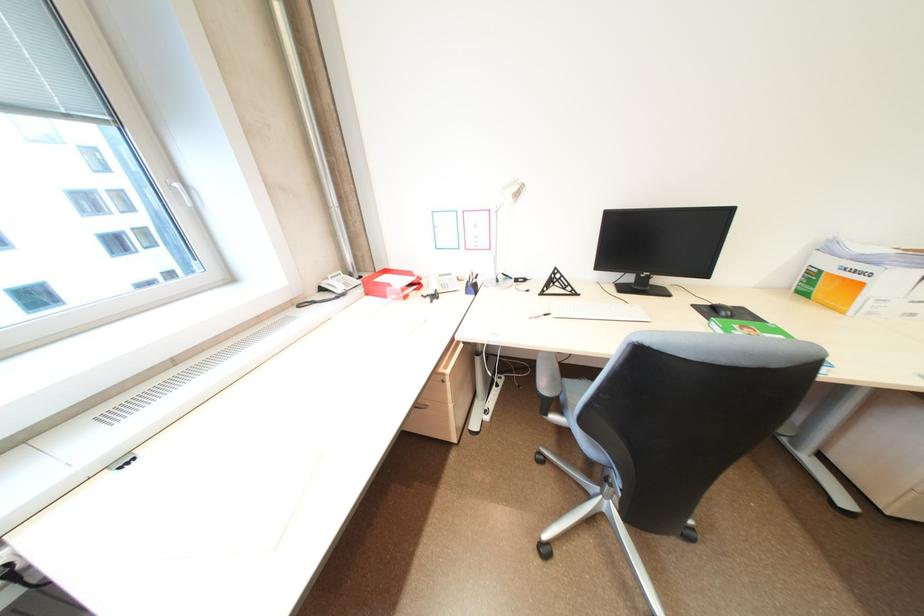
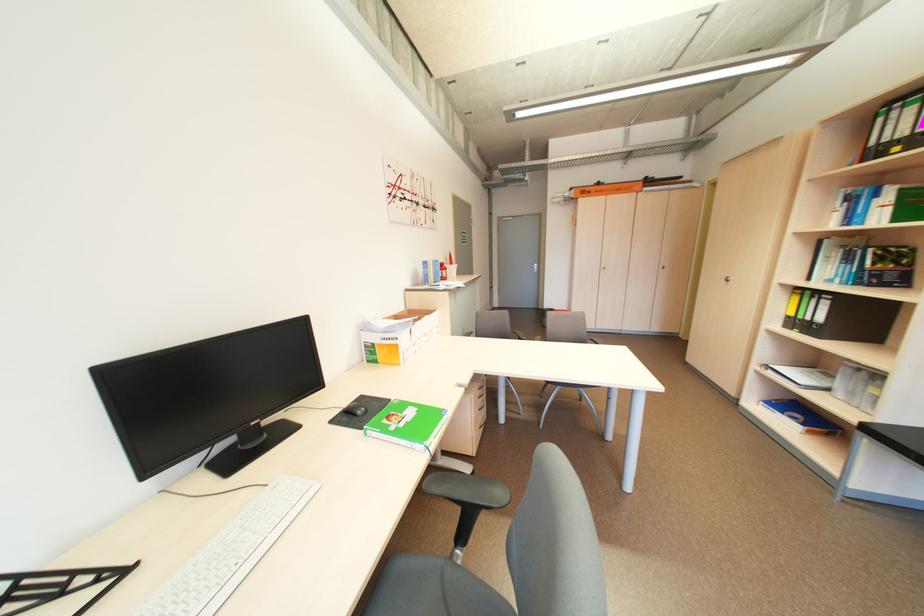
Question: The first image is from the beginning of the video and the second image is from the end. How did the camera likely rotate when shooting the video?

Choices:
 (A) Left
 (B) Right
 (C) Up
 (D) Down

Answer: (B)